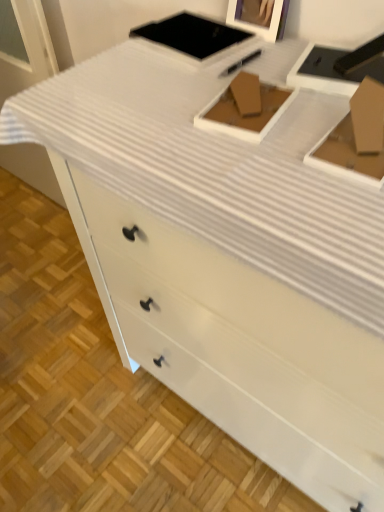
The height and width of the screenshot is (512, 384). In order to click on free spot to the left of wooden picture frame at upper center in this screenshot , I will do point(166,52).